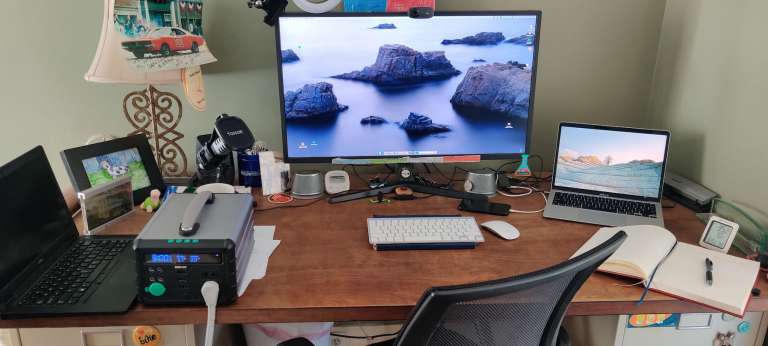
Locate an element on the screen. Image resolution: width=768 pixels, height=346 pixels. temperature and humidity sensor is located at coordinates (717, 234).